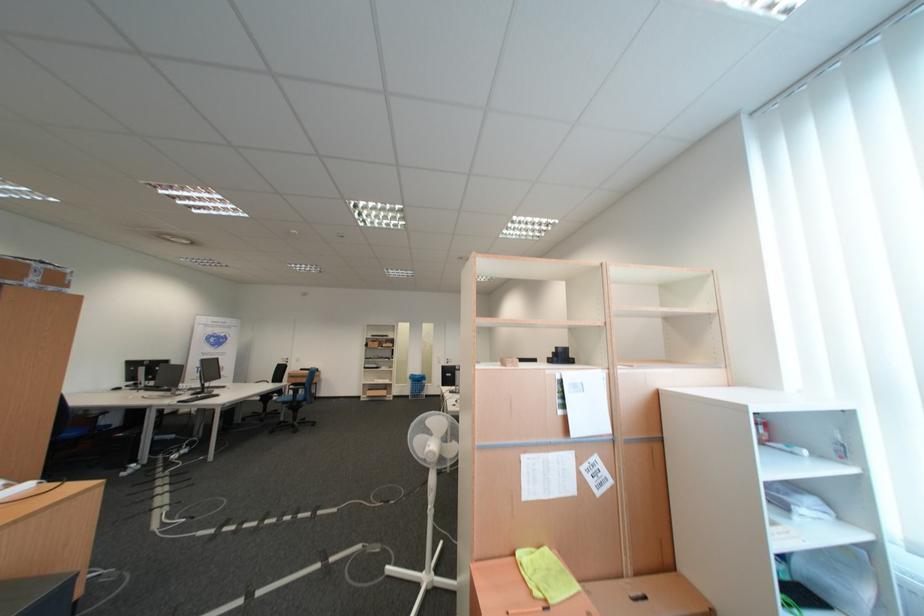
Where would you lift the blue wire basket? Please return your answer as a coordinate pair (x, y).

(417, 386)